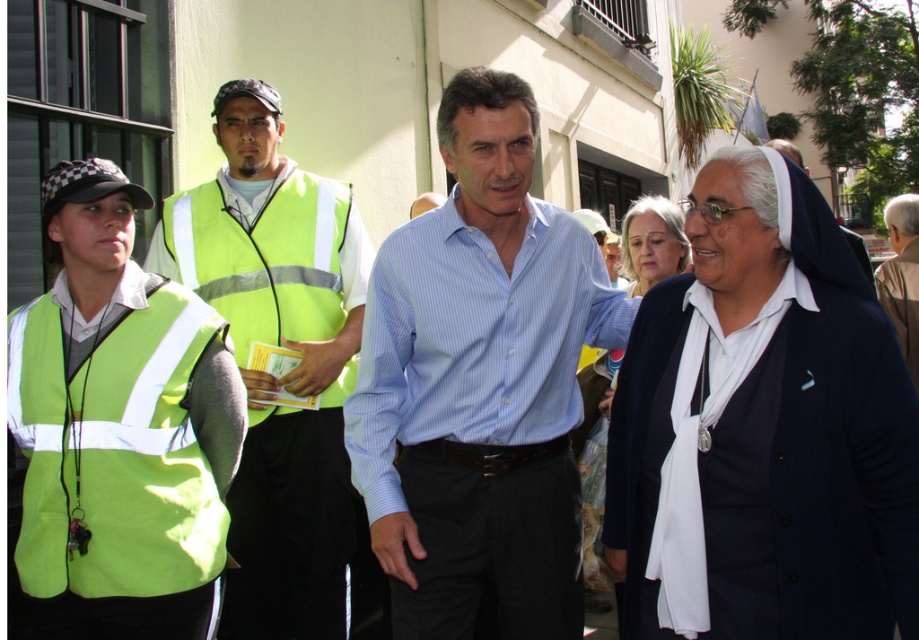
You are a drone operator trying to capture a photo of the high visibility vest at center. The drone has a camera with a 50mm lens. If the vest is at point 0.544, 0.300 in the image coordinate system, what is the exact coordinate where the drone should focus to ensure the vest is in the center of the photo?

The exact coordinate where the drone should focus to ensure the high visibility vest at center is in the center of the photo is point (275, 348).

You are standing at the origin point in the image and want to reach the two points marked as point (293,460) and point (245,266). Which point is closer to you?

Point (245,266) is closer to you because it is in front of point (293,460).